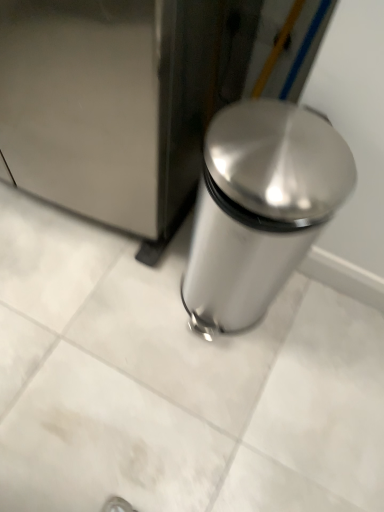
Question: Is satin silver trash can at right positioned in front of satin silver trash can at center?

Choices:
 (A) yes
 (B) no

Answer: (A)

Question: From the image's perspective, is satin silver trash can at right under satin silver trash can at center?

Choices:
 (A) yes
 (B) no

Answer: (B)

Question: From a real-world perspective, is satin silver trash can at right under satin silver trash can at center?

Choices:
 (A) yes
 (B) no

Answer: (B)

Question: From a real-world perspective, is satin silver trash can at right positioned over satin silver trash can at center based on gravity?

Choices:
 (A) no
 (B) yes

Answer: (B)

Question: Would you say satin silver trash can at right is outside satin silver trash can at center?

Choices:
 (A) yes
 (B) no

Answer: (A)

Question: Is satin silver trash can at center surrounded by satin silver trash can at right?

Choices:
 (A) no
 (B) yes

Answer: (A)

Question: Is satin silver trash can at center outside of satin silver trash can at right?

Choices:
 (A) no
 (B) yes

Answer: (B)

Question: Can you confirm if satin silver trash can at center is positioned to the right of satin silver trash can at right?

Choices:
 (A) no
 (B) yes

Answer: (B)

Question: From a real-world perspective, is satin silver trash can at center positioned over satin silver trash can at right based on gravity?

Choices:
 (A) yes
 (B) no

Answer: (B)

Question: Can you confirm if satin silver trash can at center is shorter than satin silver trash can at right?

Choices:
 (A) yes
 (B) no

Answer: (A)

Question: Is satin silver trash can at center further to camera compared to satin silver trash can at right?

Choices:
 (A) no
 (B) yes

Answer: (B)

Question: Is satin silver trash can at center in contact with satin silver trash can at right?

Choices:
 (A) no
 (B) yes

Answer: (A)

Question: Considering the positions of satin silver trash can at right and satin silver trash can at center in the image, is satin silver trash can at right wider or thinner than satin silver trash can at center?

Choices:
 (A) thin
 (B) wide

Answer: (B)